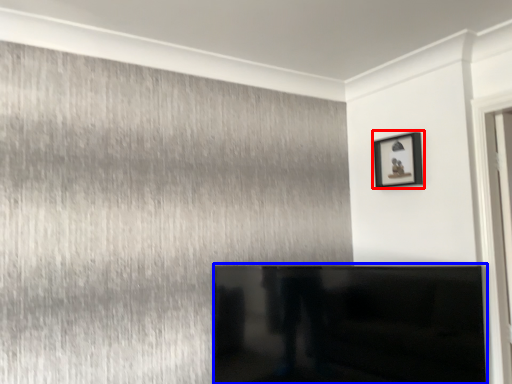
Question: Which of the following is the farthest to the observer, picture frame (highlighted by a red box) or furniture (highlighted by a blue box)?

Choices:
 (A) picture frame
 (B) furniture

Answer: (A)